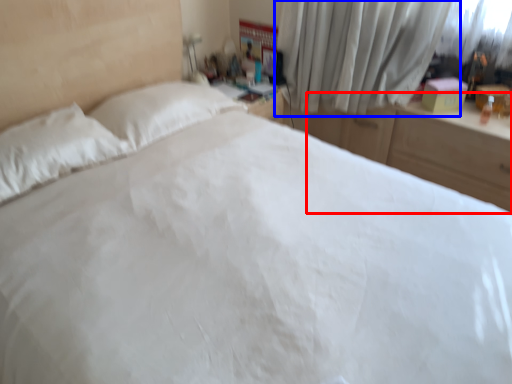
Question: Which point is closer to the camera, dresser (highlighted by a red box) or curtain (highlighted by a blue box)?

Choices:
 (A) dresser
 (B) curtain

Answer: (A)